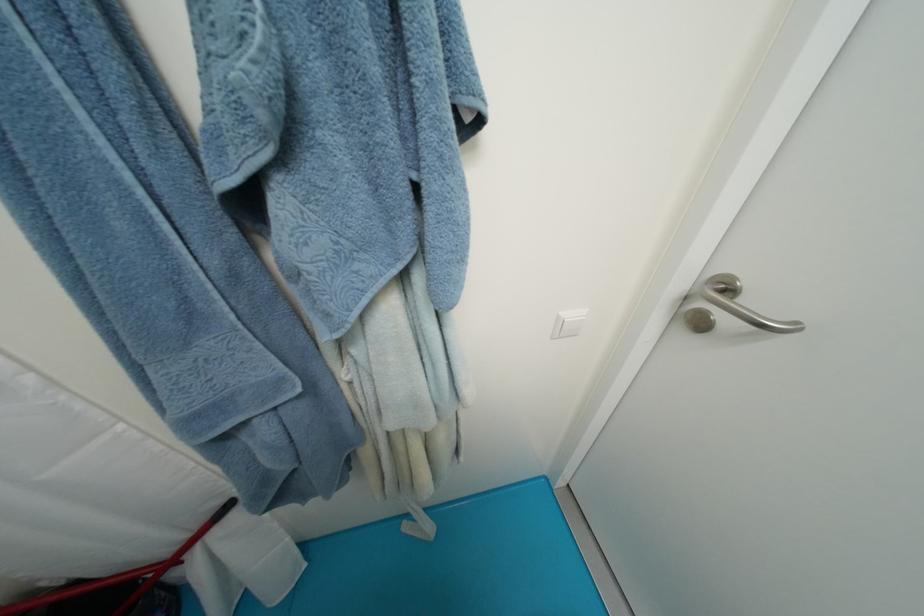
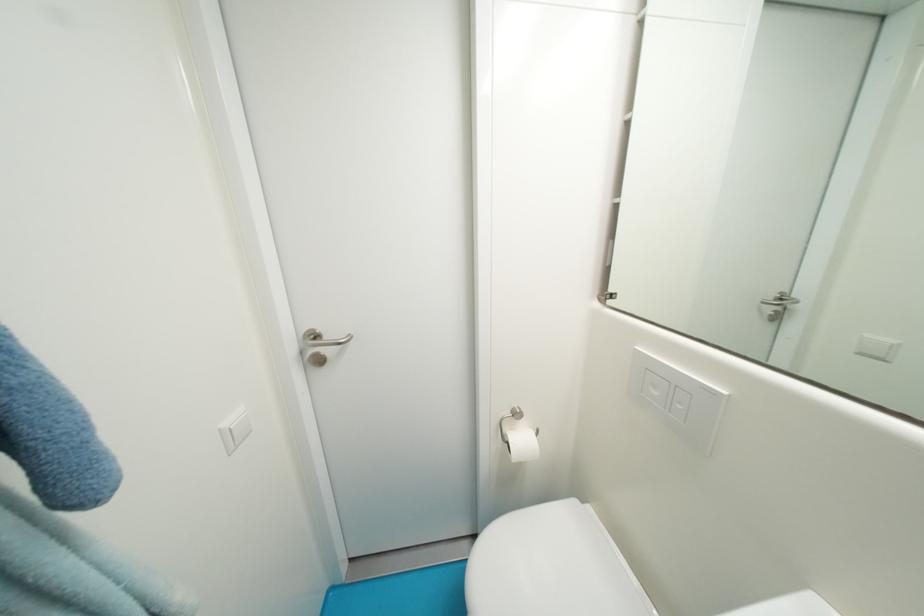
The point at (736, 293) is marked in the first image. Where is the corresponding point in the second image?

(323, 339)